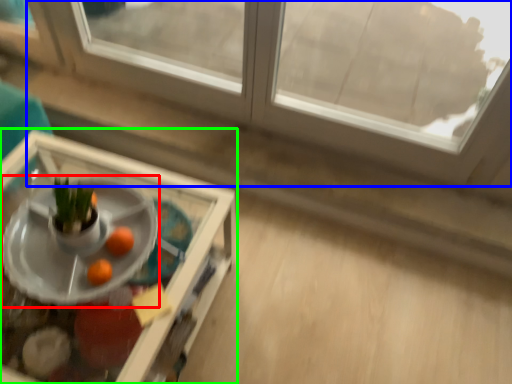
Question: Which object is the closest to the table (highlighted by a red box)? Choose among these: window (highlighted by a blue box) or table (highlighted by a green box).

Choices:
 (A) window
 (B) table

Answer: (B)